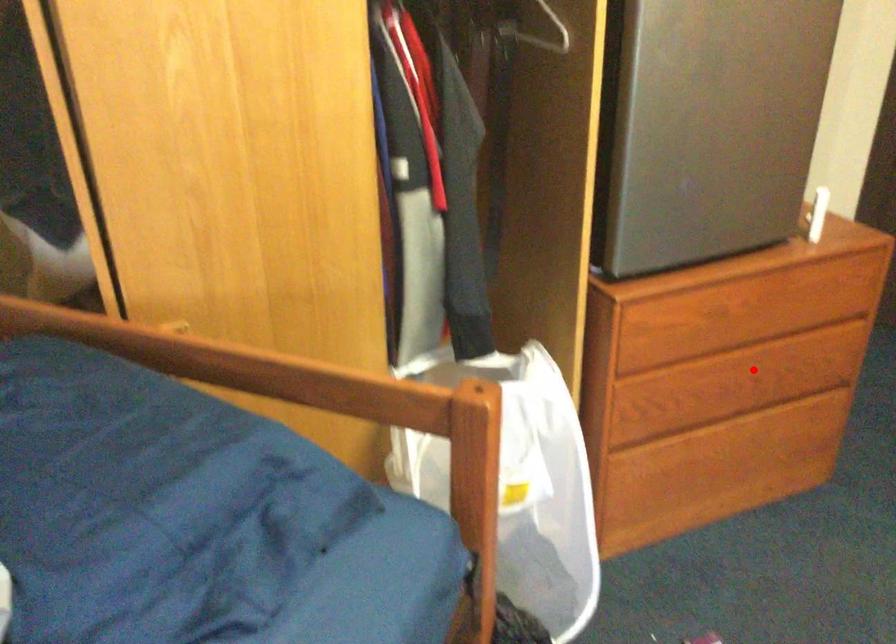
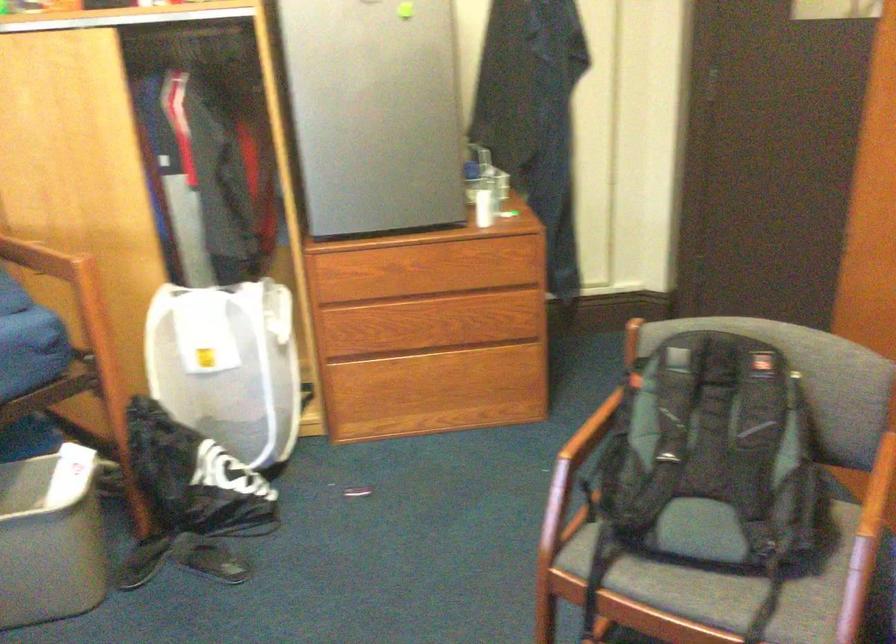
Locate, in the second image, the point that corresponds to the highlighted location in the first image.

(445, 322)